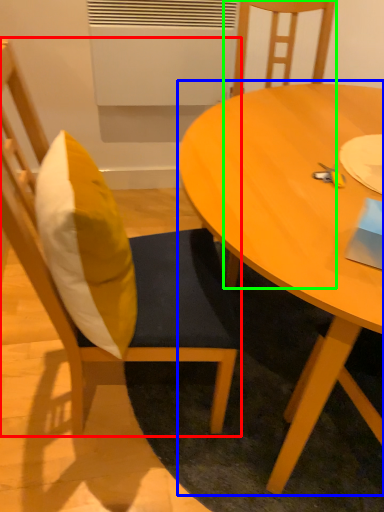
Question: Based on their relative distances, which object is farther from chair (highlighted by a red box)? Choose from coffee table (highlighted by a blue box) and chair (highlighted by a green box).

Choices:
 (A) coffee table
 (B) chair

Answer: (B)